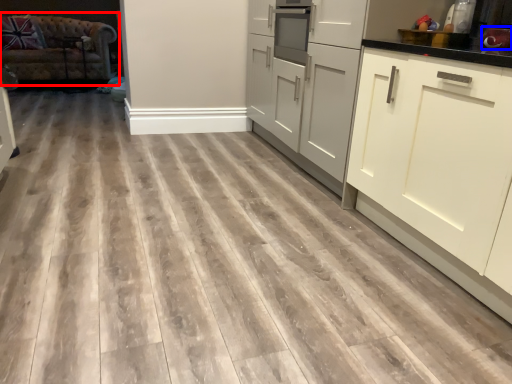
Question: Which point is closer to the camera, studio couch (highlighted by a red box) or appliance (highlighted by a blue box)?

Choices:
 (A) studio couch
 (B) appliance

Answer: (B)